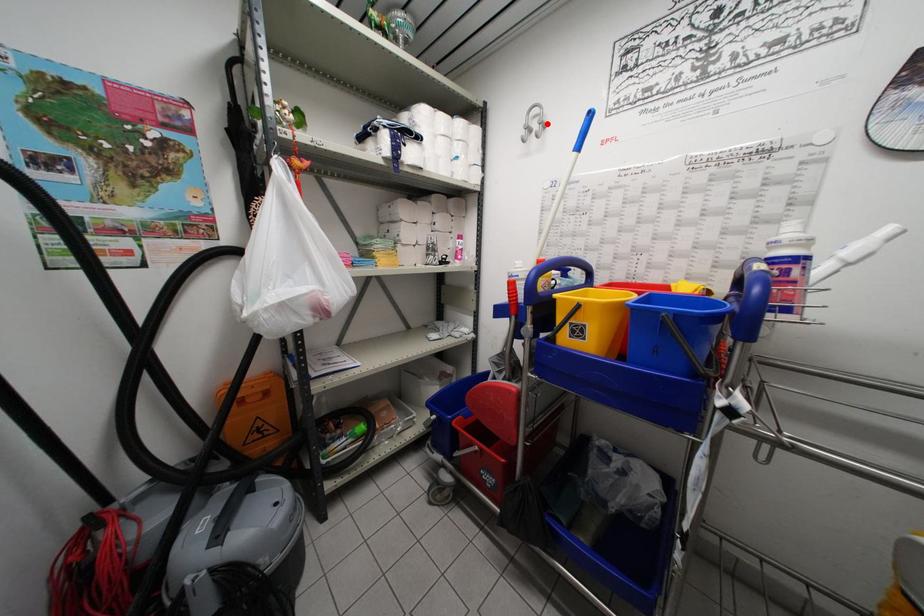
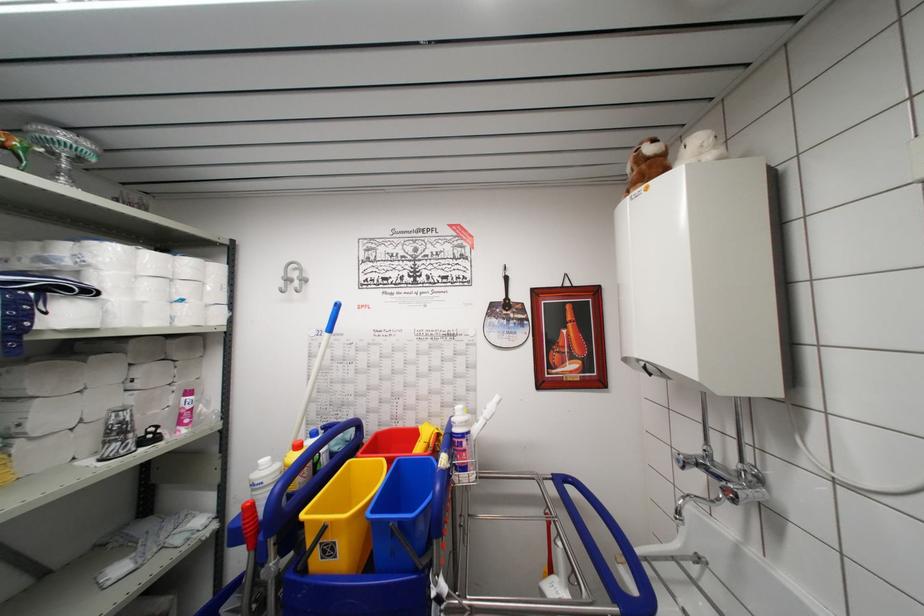
Find the pixel in the second image that matches the highlighted location in the first image.

(307, 280)